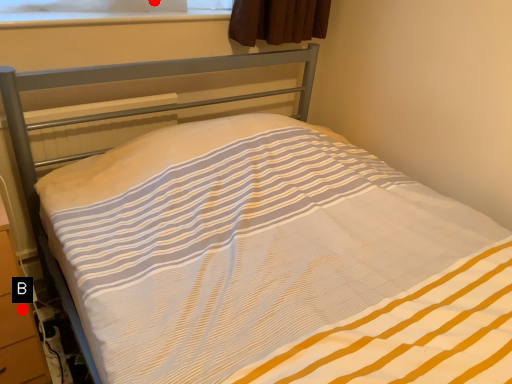
Question: Two points are circled on the image, labeled by A and B beside each circle. Which point is further to the camera?

Choices:
 (A) A is further
 (B) B is further

Answer: (A)